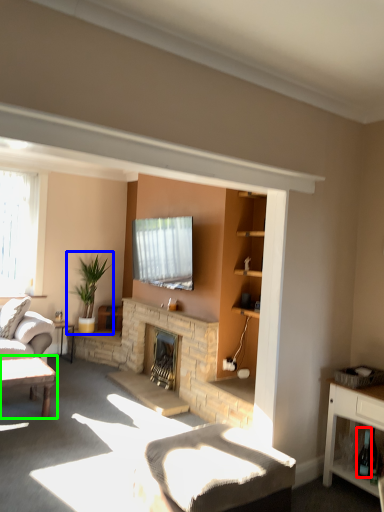
Question: Estimate the real-world distances between objects in this image. Which object is farther from wine bottle (highlighted by a red box), houseplant (highlighted by a blue box) or table (highlighted by a green box)?

Choices:
 (A) houseplant
 (B) table

Answer: (A)